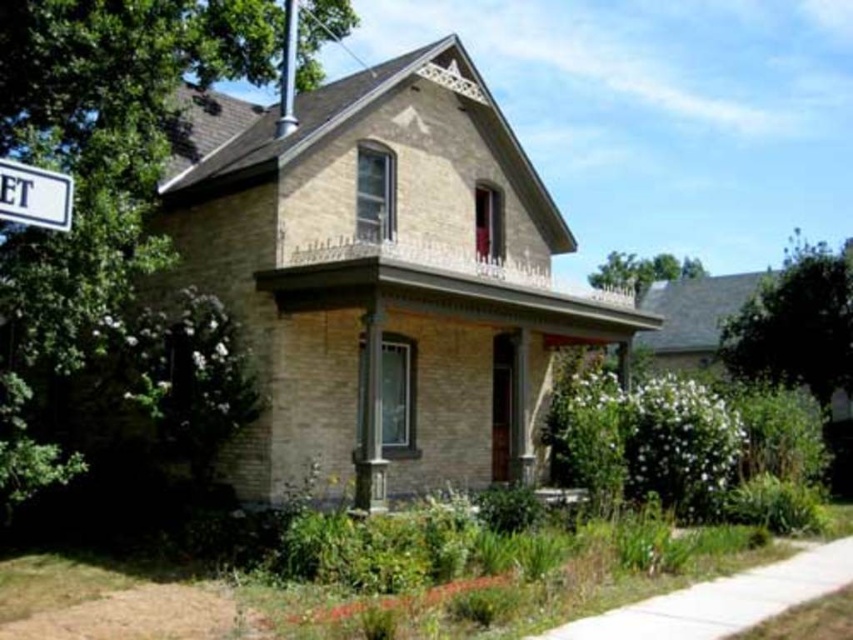
You are standing on the front porch of the Victorian house and want to locate both the white plastic street sign at upper left and the silver metallic pole at upper center. From your perspective, which object is positioned more to the left?

The white plastic street sign at upper left is positioned more to the left than the silver metallic pole at upper center.

You are a delivery driver approaching the house and need to navigate around the white plastic street sign at upper left and the silver metallic pole at upper center. Which object has a smaller width and would be easier to avoid?

The white plastic street sign at upper left is thinner than the silver metallic pole at upper center, so it has a smaller width and would be easier to avoid.

You are standing in front of the house and want to take a photo. You notice two points marked on the house facade. Which point, point (22, 211) or point (288, 109), will appear larger in your camera view?

Point (22, 211) will appear larger in the camera view because it is closer to the camera than point (288, 109).